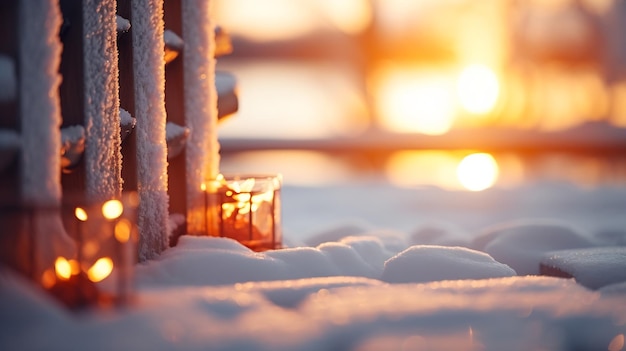
Locate an element on the screen. The width and height of the screenshot is (626, 351). light inside frames is located at coordinates (69, 269), (99, 267), (233, 207), (248, 210).